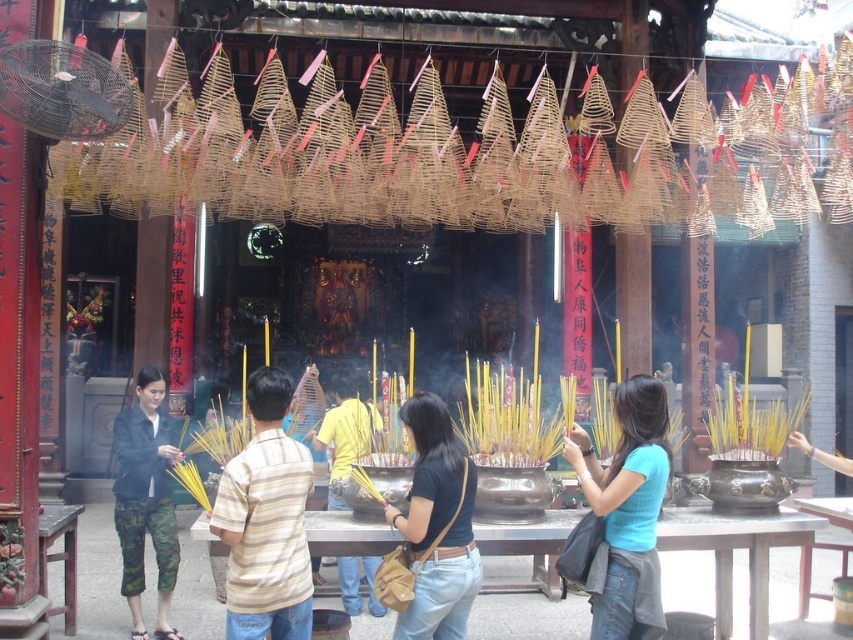
Where is `striped cotton shirt at center`? striped cotton shirt at center is located at coordinates (265, 522).

Is striped cotton shirt at center closer to the viewer compared to black leather bag at center?

Yes, it is in front of black leather bag at center.

Identify the location of striped cotton shirt at center. Image resolution: width=853 pixels, height=640 pixels. (265, 522).

Based on the photo, who is positioned more to the right, blue cotton shirt at center or camouflage pants at lower left?

blue cotton shirt at center

Describe the element at coordinates (625, 512) in the screenshot. I see `blue cotton shirt at center` at that location.

Identify the location of blue cotton shirt at center. (625, 512).

Is blue cotton shirt at center closer to camera compared to black leather bag at center?

Yes, it is in front of black leather bag at center.

Who is positioned more to the left, blue cotton shirt at center or black leather bag at center?

From the viewer's perspective, black leather bag at center appears more on the left side.

Identify the location of blue cotton shirt at center. The width and height of the screenshot is (853, 640). (625, 512).